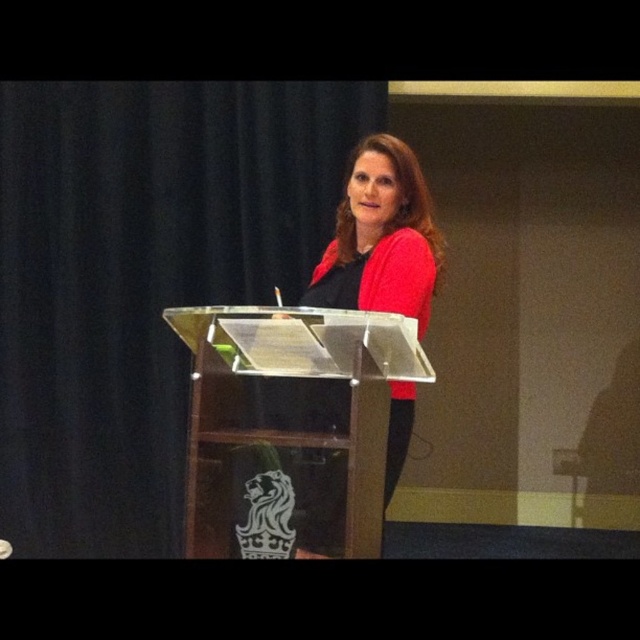
Question: Among these objects, which one is farthest from the camera?

Choices:
 (A) clear acrylic podium at center
 (B) matte red sweater at center

Answer: (B)

Question: Can you confirm if clear acrylic podium at center is bigger than matte red sweater at center?

Choices:
 (A) yes
 (B) no

Answer: (A)

Question: Which of the following is the closest to the observer?

Choices:
 (A) (397, 212)
 (B) (314, 401)

Answer: (B)

Question: Does clear acrylic podium at center come in front of matte red sweater at center?

Choices:
 (A) yes
 (B) no

Answer: (A)

Question: Can you confirm if clear acrylic podium at center is bigger than matte red sweater at center?

Choices:
 (A) yes
 (B) no

Answer: (A)

Question: Which object appears farthest from the camera in this image?

Choices:
 (A) matte red sweater at center
 (B) clear acrylic podium at center

Answer: (A)